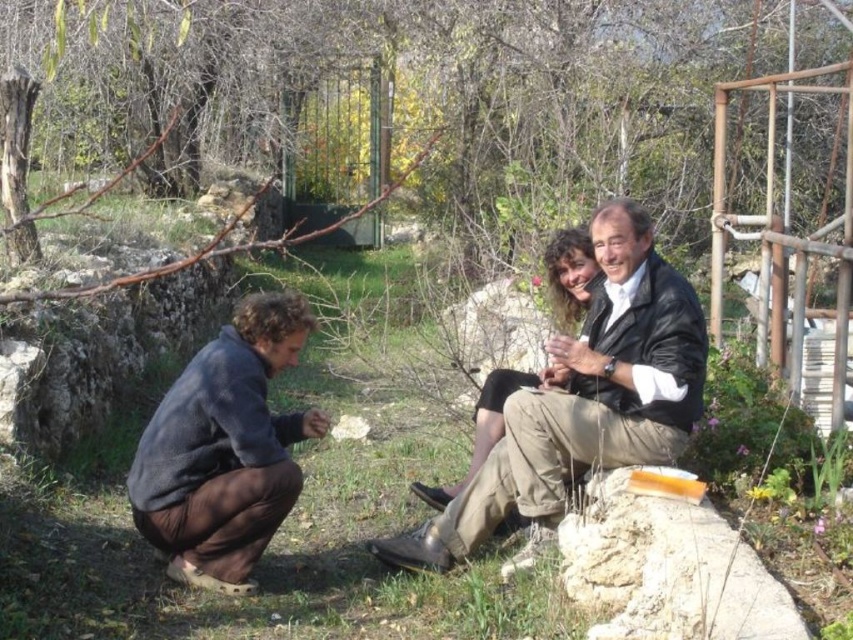
You are standing in the garden and want to place a small item on the leather jacket at center without it falling off. Considering the dark blue fleece at lower left is nearby, which object should you place it on and why?

You should place the small item on the leather jacket at center because it is in front of the dark blue fleece at lower left, making it more stable and less likely to slide off.

You are standing in the garden and want to place a small item between the dark blue fleece at lower left and the matte black jacket at center. Which object should you place it closer to if you want the item to be closer to the taller object?

The dark blue fleece at lower left is taller than the matte black jacket at center, so placing the item closer to the dark blue fleece at lower left would make it nearer to the taller object.

From the picture: You are standing in the garden and want to place a small flag at each of the two points labeled point (444, 547) and point (463, 481). Which point should you place the flag closer to the camera?

Point (444, 547) is closer to the camera than point (463, 481), so you should place the flag at point 0.853, 0.522 to be closer to the camera.